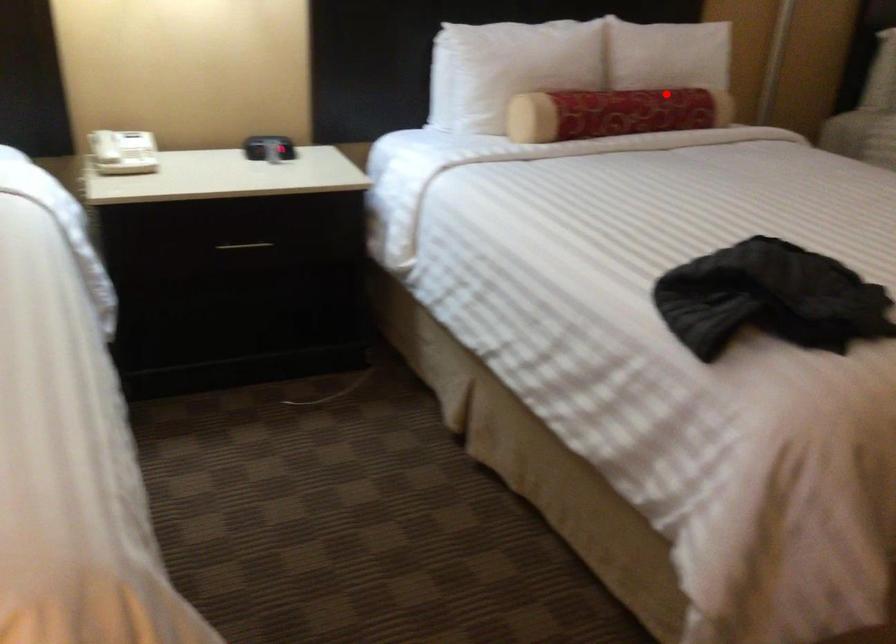
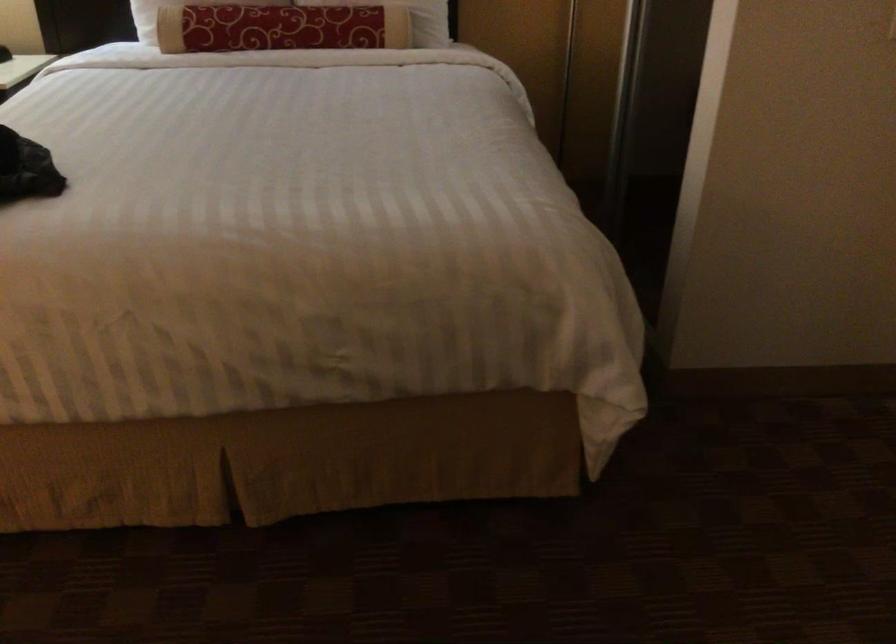
The point at the highlighted location is marked in the first image. Where is the corresponding point in the second image?

(311, 15)